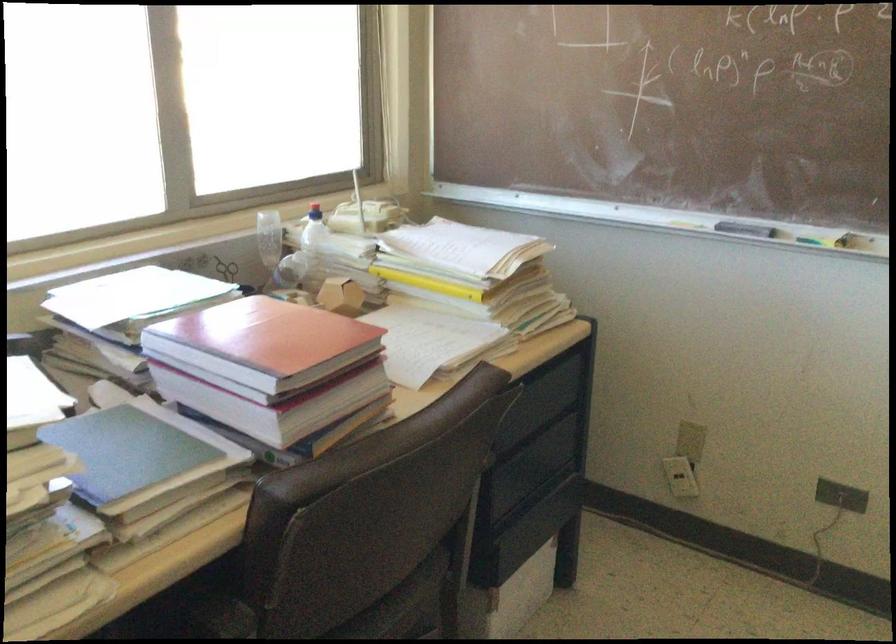
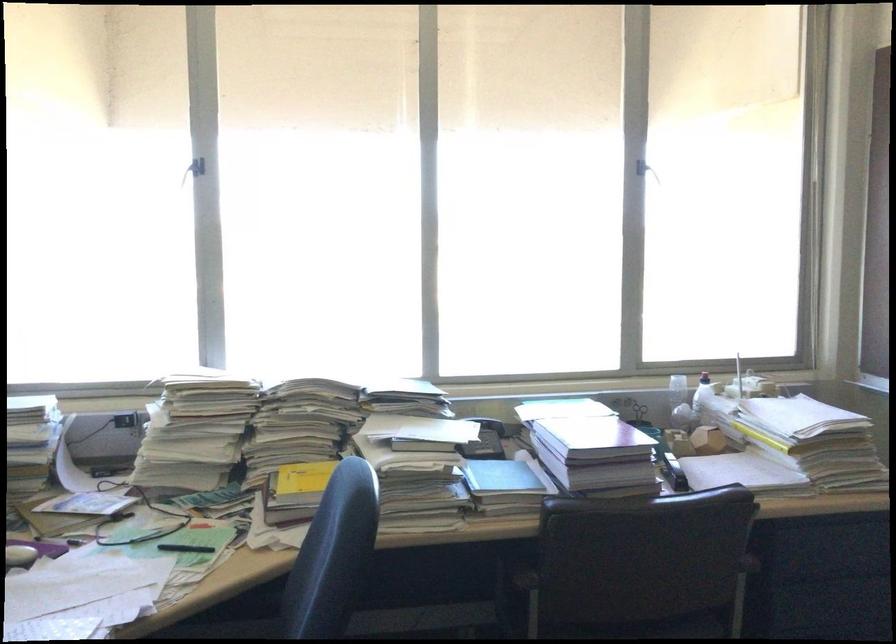
Find the pixel in the second image that matches point 316,234 in the first image.

(702, 392)